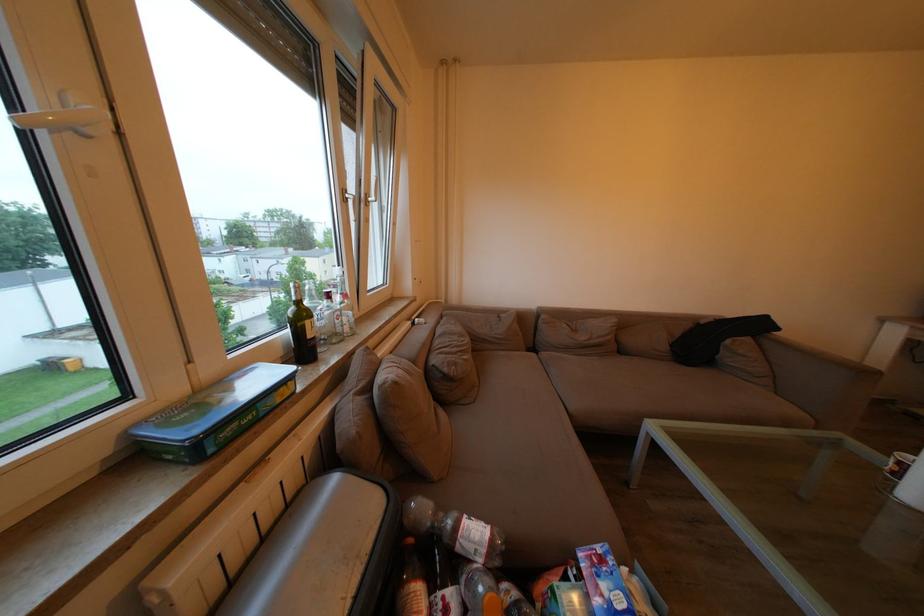
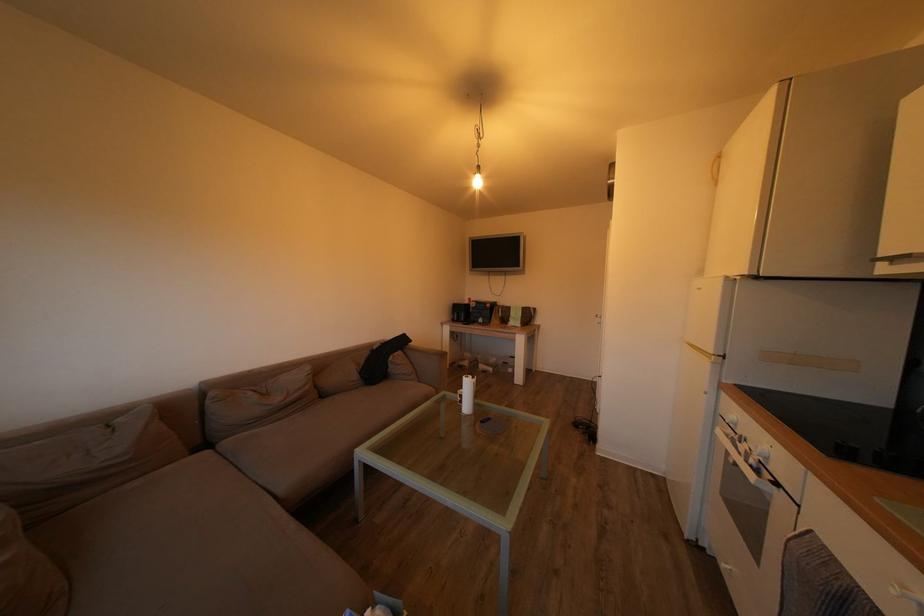
In the second image, find the point that corresponds to point 672,352 in the first image.

(362, 382)